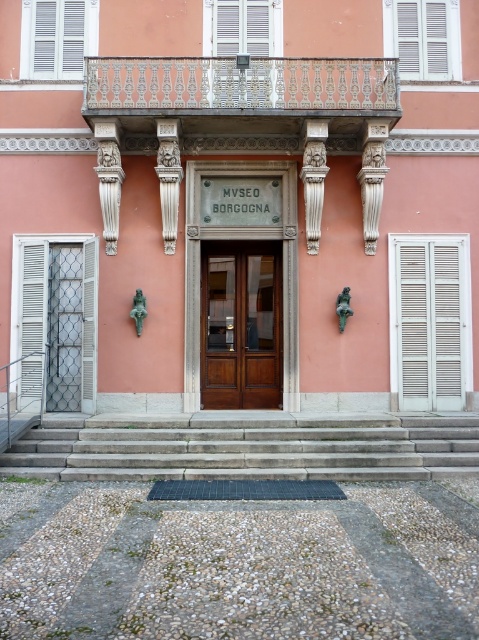
You are standing at the entrance of MUSEO BORGOGNA and notice two shutters. The white textured shutter at left and the white matte shutter at upper right. Which one is positioned more to the left side of the entrance?

The white textured shutter at left is positioned more to the left side of the entrance compared to the white matte shutter at upper right.

You are a window installer assessing the entrance of MUSEO BORGOGNA. You need to replace the shutters. The new shutters must match the height of the existing ones. Which shutter has a greater height between the white textured shutter at left and the white matte shutter at upper right?

The white textured shutter at left has a greater height compared to the white matte shutter at upper right, so you should match the height of the white textured shutter at left when installing new shutters.